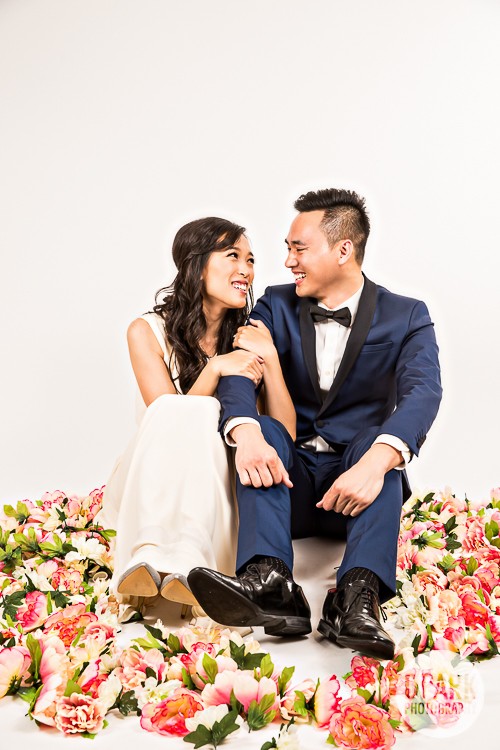
I want to click on orchids, so click(23, 553), click(72, 654), click(187, 718), click(350, 712), click(430, 615), click(460, 568), click(454, 522).